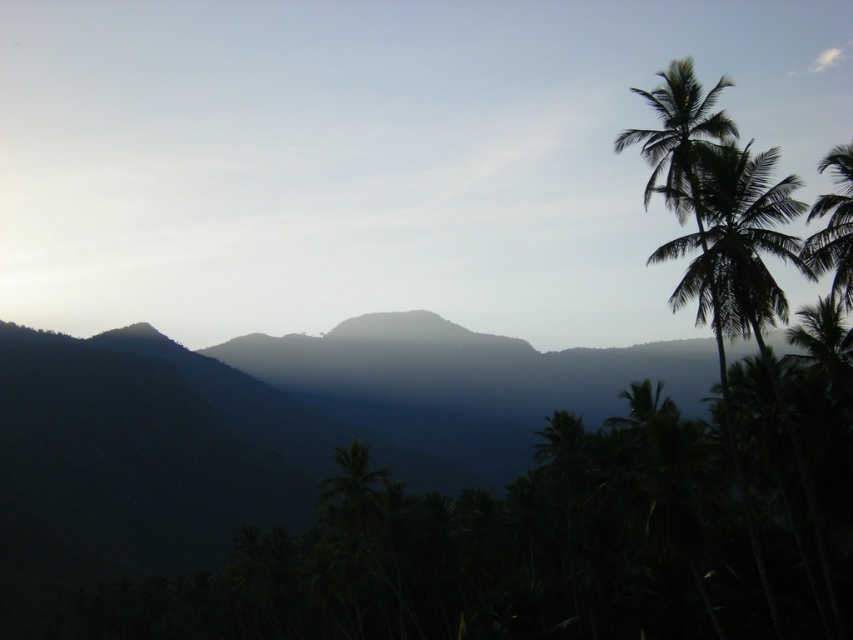
You are a photographer trying to capture the sunset scene with both the green leafy palm tree at upper right and the green leafy palm tree at right in your shot. Which palm tree should you position closer to the top of your camera frame?

The green leafy palm tree at upper right should be positioned closer to the top of your camera frame because it is located above the green leafy palm tree at right.